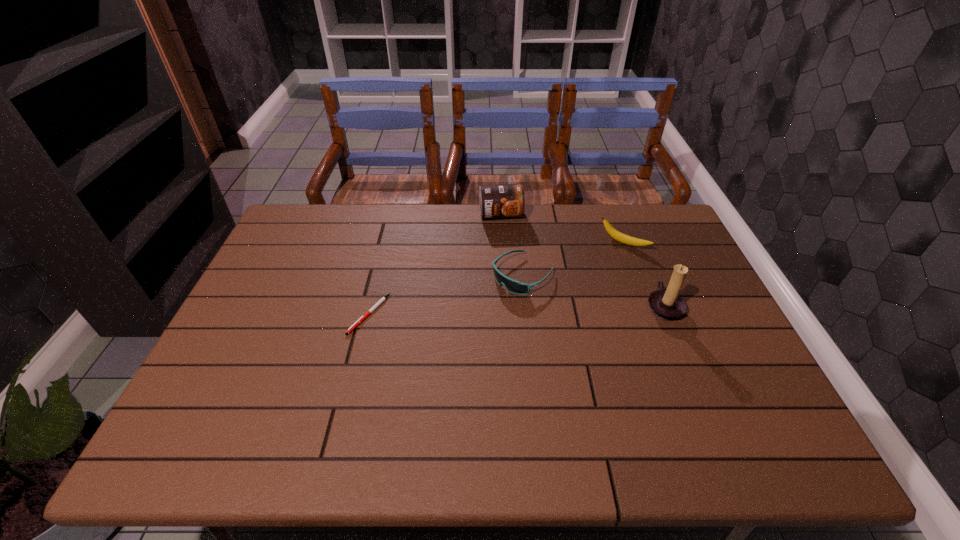
Locate an element on the screen. The width and height of the screenshot is (960, 540). free space that is in between the candle holder and the sunglasses is located at coordinates (593, 291).

Locate an element on the screen. The width and height of the screenshot is (960, 540). free space between the tallest object and the second farthest object is located at coordinates click(643, 275).

This screenshot has height=540, width=960. Identify the location of vacant space in between the sunglasses and the candle holder. (593, 291).

Identify the location of free area in between the sunglasses and the candle holder. The height and width of the screenshot is (540, 960). (593, 291).

You are a GUI agent. You are given a task and a screenshot of the screen. Output one action in this format:
    pyautogui.click(x=<x>, y=<y>)
    Task: Click on the vacant area between the candle holder and the banana
    The height and width of the screenshot is (540, 960).
    Given the screenshot: What is the action you would take?
    pyautogui.click(x=643, y=275)

I want to click on object that stands as the closest to the fourth nearest object, so click(x=668, y=305).

Identify which object is the second nearest to the fourth nearest object. Please provide its 2D coordinates. Your answer should be formatted as a tuple, i.e. [(x, y)], where the tuple contains the x and y coordinates of a point satisfying the conditions above.

[(513, 286)]

I want to click on free region that satisfies the following two spatial constraints: 1. on the front side of the candle holder; 2. on the wick of the fourth shortest object, so click(506, 307).

Where is `vacant region that satisfies the following two spatial constraints: 1. on the front side of the sunglasses; 2. on the right side of the farthest object`? The width and height of the screenshot is (960, 540). vacant region that satisfies the following two spatial constraints: 1. on the front side of the sunglasses; 2. on the right side of the farthest object is located at coordinates (504, 275).